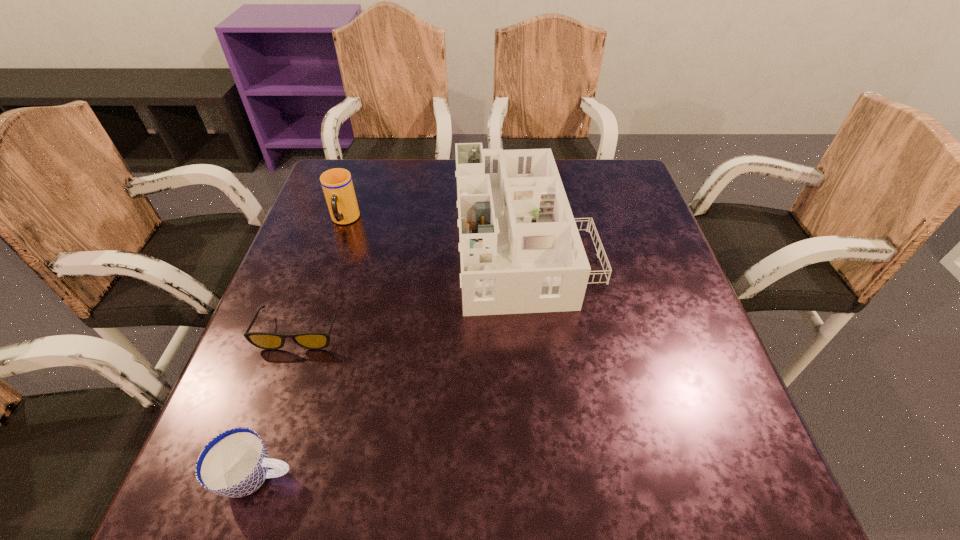
Locate an element on the screen. object that can be found as the closest to the taller cup is located at coordinates [x=520, y=250].

You are a GUI agent. You are given a task and a screenshot of the screen. Output one action in this format:
    pyautogui.click(x=<x>, y=<y>)
    Task: Click on the vacant space that satisfies the following two spatial constraints: 1. on the side of the taller cup with the handle; 2. on the right side of the dollhouse
    The width and height of the screenshot is (960, 540).
    Given the screenshot: What is the action you would take?
    pyautogui.click(x=339, y=239)

The image size is (960, 540). Find the location of `free space that satisfies the following two spatial constraints: 1. on the side of the taller cup with the handle; 2. on the left side of the rightmost object`. free space that satisfies the following two spatial constraints: 1. on the side of the taller cup with the handle; 2. on the left side of the rightmost object is located at coordinates (339, 239).

Locate an element on the screen. The image size is (960, 540). vacant region that satisfies the following two spatial constraints: 1. on the side of the dollhouse with the handle; 2. on the right side of the farther cup is located at coordinates (339, 239).

You are a GUI agent. You are given a task and a screenshot of the screen. Output one action in this format:
    pyautogui.click(x=<x>, y=<y>)
    Task: Click on the free space that satisfies the following two spatial constraints: 1. on the side of the farther cup with the handle; 2. on the side of the third tallest object with the handle
    The image size is (960, 540).
    Given the screenshot: What is the action you would take?
    pyautogui.click(x=258, y=476)